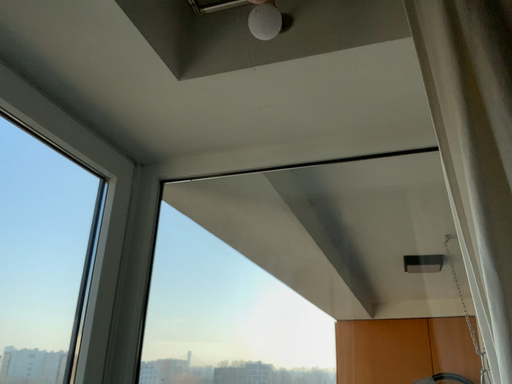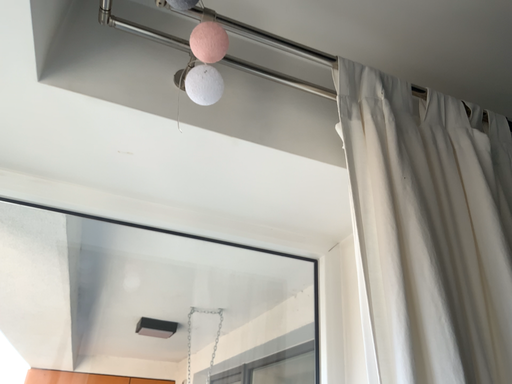
Question: How did the camera likely rotate when shooting the video?

Choices:
 (A) rotated right
 (B) rotated left

Answer: (A)